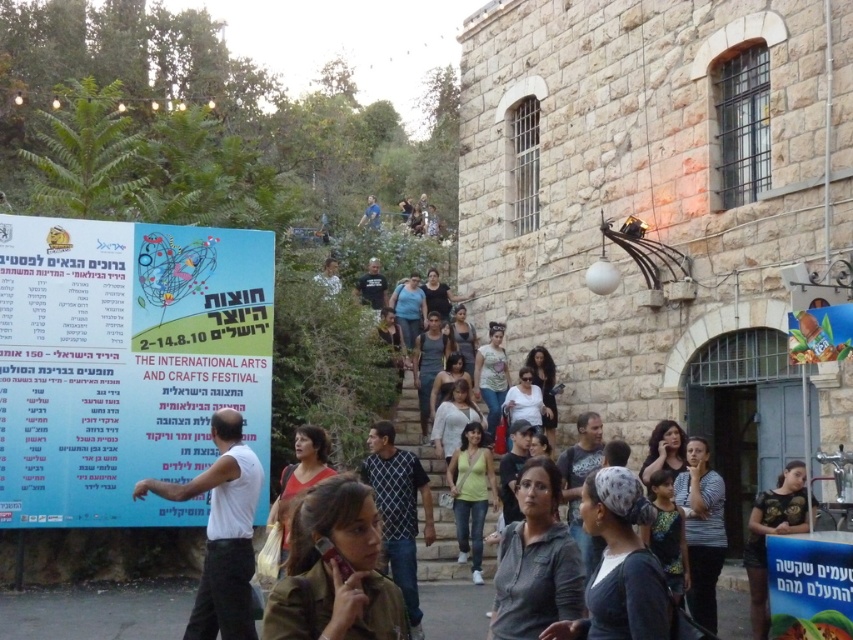
Can you confirm if white paper poster at left is positioned to the right of gray matte shirt at center?

In fact, white paper poster at left is to the left of gray matte shirt at center.

Between white paper poster at left and gray matte shirt at center, which one appears on the right side from the viewer's perspective?

gray matte shirt at center is more to the right.

This screenshot has width=853, height=640. In order to click on white paper poster at left in this screenshot , I will do `click(125, 364)`.

I want to click on white paper poster at left, so click(x=125, y=364).

Who is more distant from viewer, (x=558, y=573) or (x=357, y=292)?

The point (x=357, y=292) is behind.

Between gray matte shirt at center and black cotton t-shirt at center, which one appears on the left side from the viewer's perspective?

black cotton t-shirt at center is more to the left.

Describe the element at coordinates (535, 561) in the screenshot. I see `gray matte shirt at center` at that location.

Image resolution: width=853 pixels, height=640 pixels. Identify the location of gray matte shirt at center. (535, 561).

Is dark blue checkered shirt at center to the left of dark brown shirt at lower right from the viewer's perspective?

Correct, you'll find dark blue checkered shirt at center to the left of dark brown shirt at lower right.

Which is below, dark blue checkered shirt at center or dark brown shirt at lower right?

dark brown shirt at lower right

Where is `dark blue checkered shirt at center`? Image resolution: width=853 pixels, height=640 pixels. dark blue checkered shirt at center is located at coordinates [398, 512].